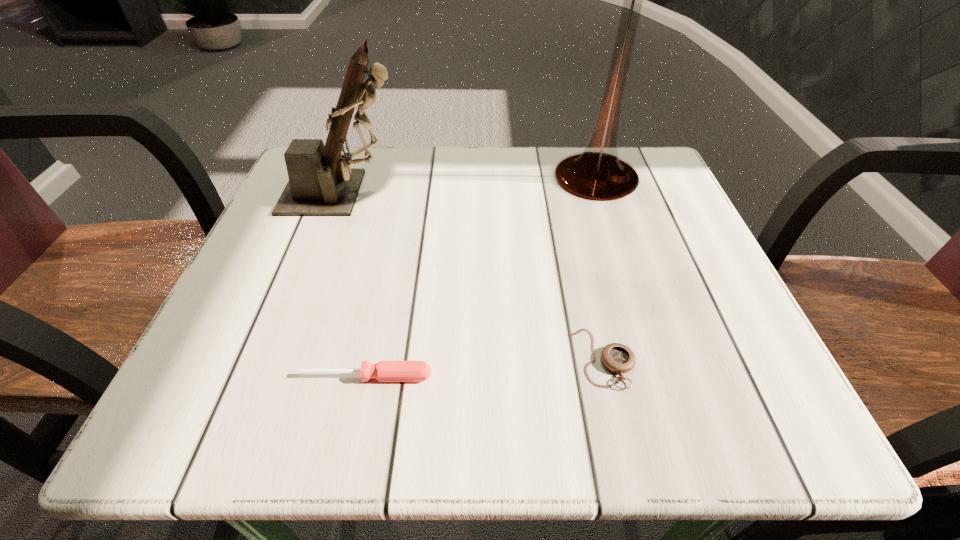
Locate an element on the screen. This screenshot has width=960, height=540. table lamp is located at coordinates (598, 173).

You are a GUI agent. You are given a task and a screenshot of the screen. Output one action in this format:
    pyautogui.click(x=<x>, y=<y>)
    Task: Click on the figurine
    This screenshot has width=960, height=540.
    Given the screenshot: What is the action you would take?
    pyautogui.click(x=321, y=182)

At what (x,y) coordinates should I click in order to perform the action: click on the second shortest object. Please return your answer as a coordinate pair (x, y). The height and width of the screenshot is (540, 960). Looking at the image, I should click on (384, 371).

At what (x,y) coordinates should I click in order to perform the action: click on the shortest object. Please return your answer as a coordinate pair (x, y). The width and height of the screenshot is (960, 540). Looking at the image, I should click on (618, 358).

Locate an element on the screen. vacant point located 0.130m above the cylindrical shade of the table lamp is located at coordinates (623, 261).

Identify the location of vacant space located 0.050m on the front-facing side of the third shortest object. (429, 193).

Identify the location of vacant region located 0.390m on the right of the screwdriver. This screenshot has height=540, width=960. (717, 376).

This screenshot has width=960, height=540. What are the coordinates of `blank space located 0.330m on the left of the shortest object` in the screenshot? It's located at (339, 358).

Find the location of a particular element. table lamp present at the far edge is located at coordinates (598, 173).

Locate an element on the screen. figurine situated at the far edge is located at coordinates (321, 182).